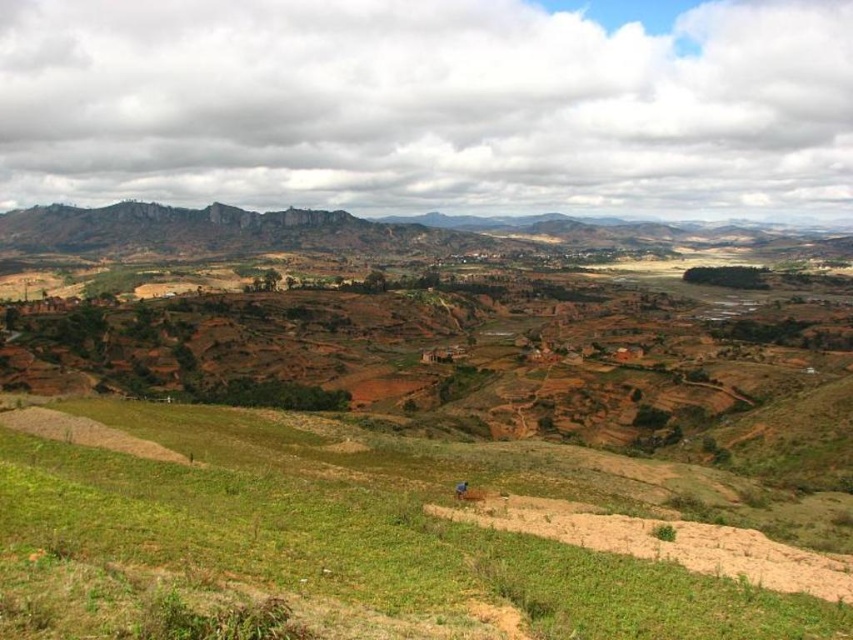
You are a drone operator tasked with capturing aerial footage of the green grassy field at lower center and the blue fabric person at center. Based on the scene description, which object would require a wider shot to fully capture in the frame?

The green grassy field at lower center would require a wider shot because it is bigger than the blue fabric person at center.

You are standing at the edge of the green grassy field at lower center and want to reach the blue fabric person at center. Which direction should you walk to get there?

The green grassy field at lower center is to the left of the blue fabric person at center, so you should walk to the right to reach them.

You are a drone operator trying to capture aerial footage of the green grassy field at lower center and the blue fabric person at center. From your current position, which object would appear larger in the camera frame?

The green grassy field at lower center would appear larger in the camera frame because it is much taller than the blue fabric person at center.